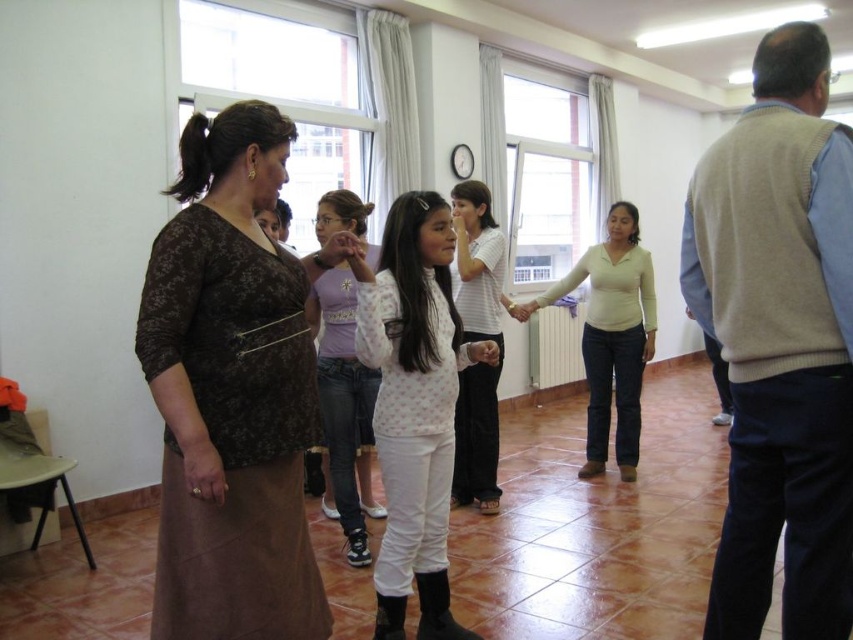
Question: Among these points, which one is farthest from the camera?

Choices:
 (A) (302, 536)
 (B) (312, 282)

Answer: (B)

Question: Is white matte pants at center closer to camera compared to white matte sweater at center?

Choices:
 (A) yes
 (B) no

Answer: (A)

Question: Which of the following is the farthest from the observer?

Choices:
 (A) (757, 429)
 (B) (241, 362)

Answer: (A)

Question: Which of the following is the farthest from the observer?

Choices:
 (A) white matte pants at center
 (B) light purple denim jeans at center

Answer: (B)

Question: Does white matte pants at center appear on the left side of light purple denim jeans at center?

Choices:
 (A) no
 (B) yes

Answer: (A)

Question: Does brown textured skirt at left lie in front of light purple denim jeans at center?

Choices:
 (A) no
 (B) yes

Answer: (B)